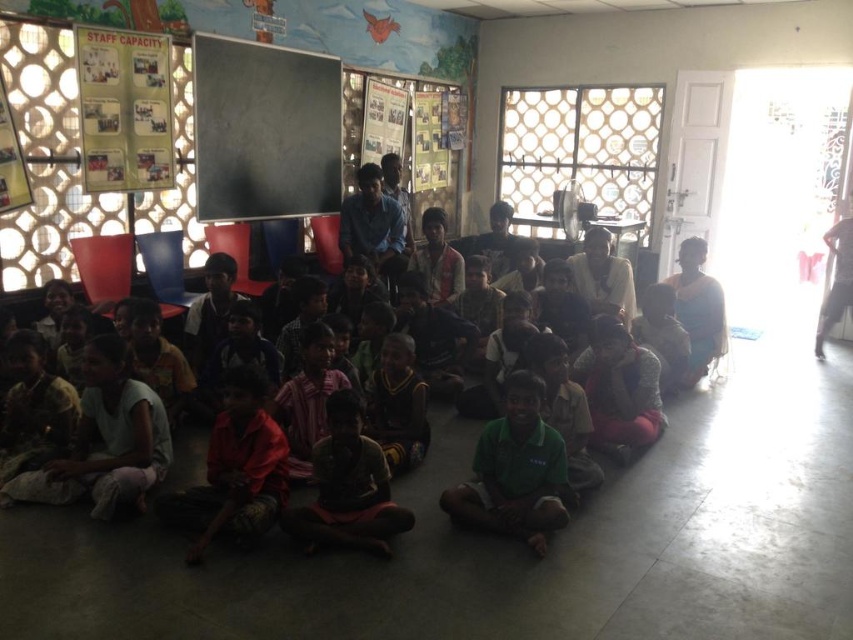
Question: Which point is closer to the camera?

Choices:
 (A) green fabric shirt at center
 (B) red cotton shirt at lower left

Answer: (B)

Question: Observing the image, what is the correct spatial positioning of green fabric shirt at center in reference to dark green fabric at lower center?

Choices:
 (A) above
 (B) below

Answer: (B)

Question: Which object is closer to the camera taking this photo?

Choices:
 (A) dark green fabric shirt at center
 (B) red cotton shirt at lower left
 (C) green fabric shirt at center
 (D) black matte chalkboard at upper center

Answer: (B)

Question: Which object is positioned farthest from the dark green fabric shirt at center?

Choices:
 (A) red cotton shirt at lower left
 (B) dark green fabric at lower center

Answer: (B)

Question: Is black matte chalkboard at upper center above dark green fabric shirt at center?

Choices:
 (A) no
 (B) yes

Answer: (B)

Question: Can you confirm if green fabric shirt at center is thinner than red cotton shirt at lower left?

Choices:
 (A) no
 (B) yes

Answer: (A)